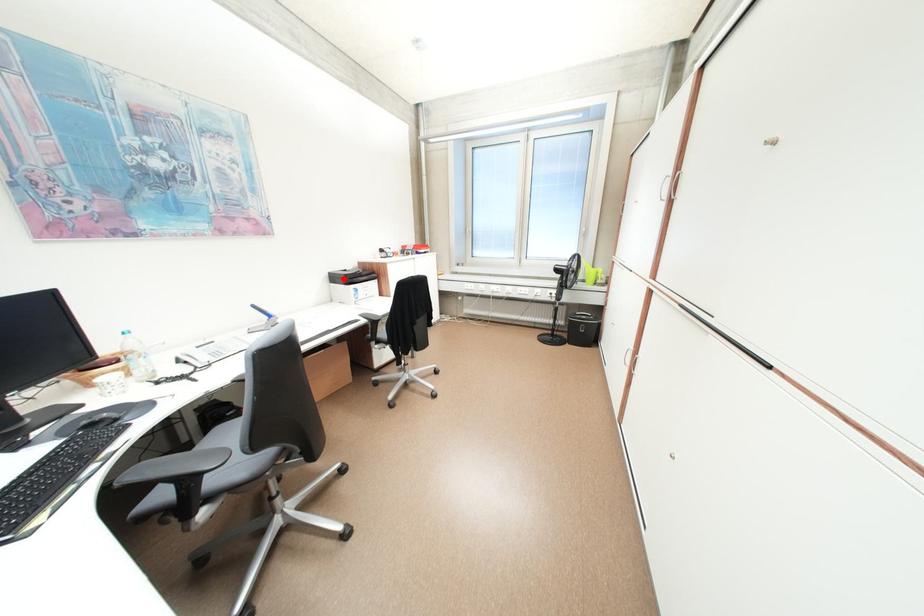
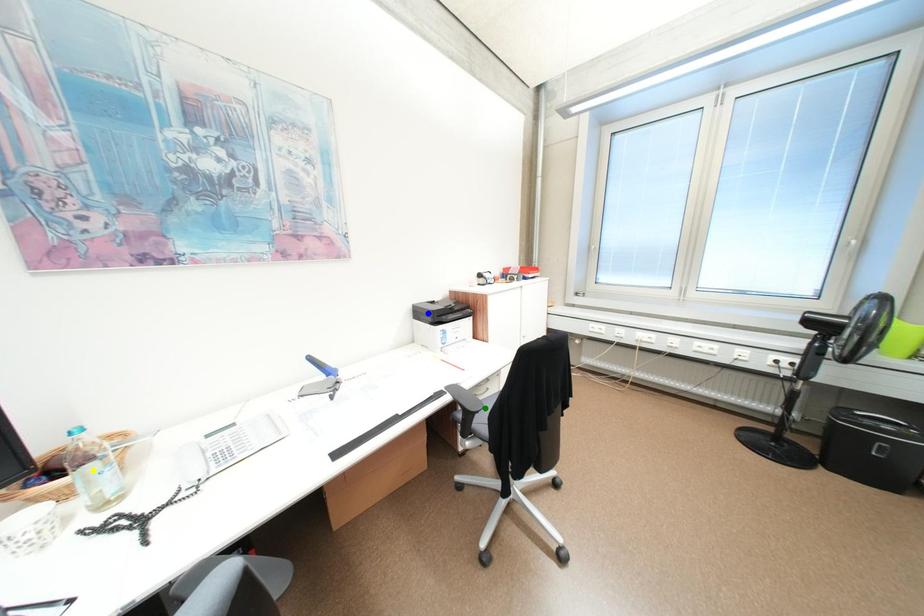
Question: I am providing you with two images of the same scene from different viewpoints. A red point is marked on the first image. You are given multiple points on the second image. Which point in image 2 represents the same 3d spot as the red point in image 1?

Choices:
 (A) yellow point
 (B) green point
 (C) blue point

Answer: (C)